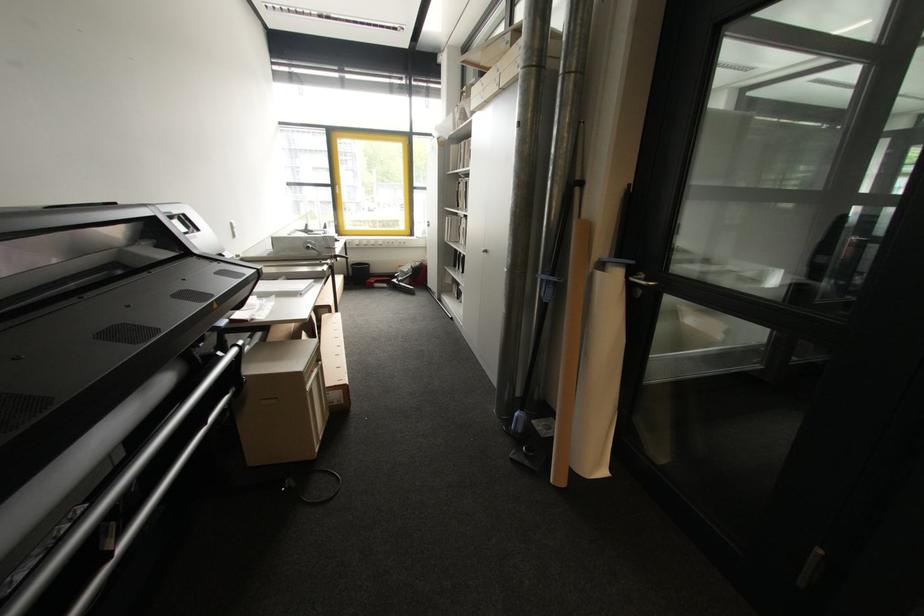
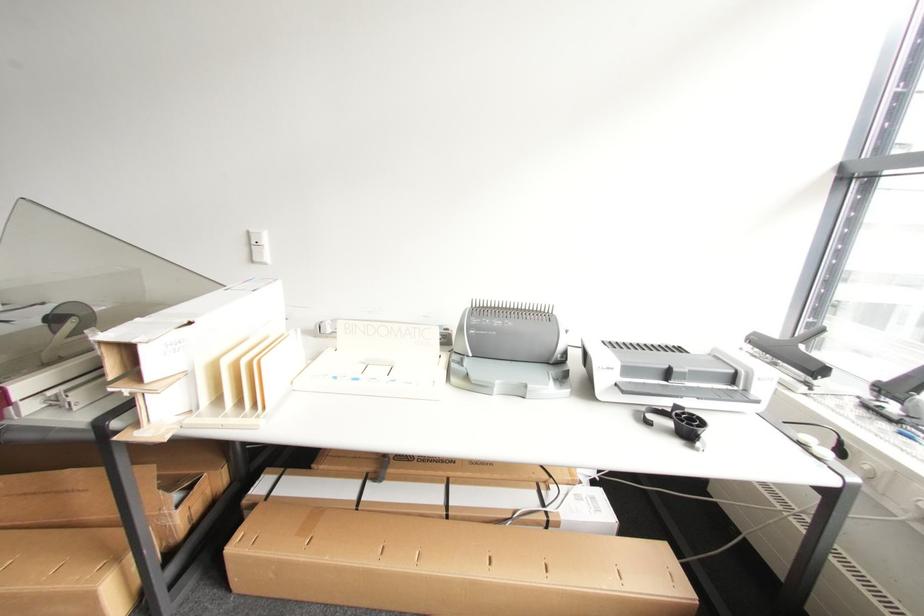
The point at (238, 231) is marked in the first image. Where is the corresponding point in the second image?

(257, 248)